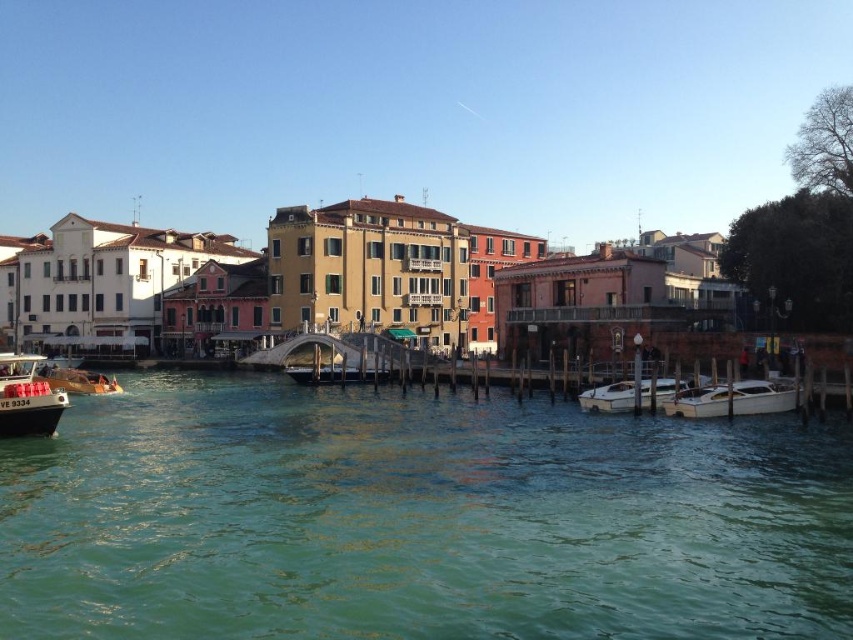
Who is taller, white glossy boat at lower center or shiny silver boat at center?

white glossy boat at lower center is taller.

Who is more distant from viewer, [642,388] or [344,376]?

Positioned behind is point [344,376].

Does point (608, 412) come farther from viewer compared to point (328, 369)?

No, it is in front of (328, 369).

Locate an element on the screen. white glossy boat at lower center is located at coordinates (608, 397).

Measure the distance between matte black boat at lower left and camera.

matte black boat at lower left and camera are 57.42 meters apart.

Is matte black boat at lower left taller than white glossy boat at lower center?

Yes, matte black boat at lower left is taller than white glossy boat at lower center.

In order to click on matte black boat at lower left in this screenshot , I will do `click(27, 397)`.

Who is positioned more to the left, white glossy boat at lower center or metallic gold boat at lower left?

From the viewer's perspective, metallic gold boat at lower left appears more on the left side.

Between point (619, 403) and point (78, 372), which one is positioned behind?

The point (78, 372) is more distant.

Is point (624, 387) in front of point (50, 380)?

Yes, it is.

The image size is (853, 640). I want to click on white glossy boat at lower center, so click(x=608, y=397).